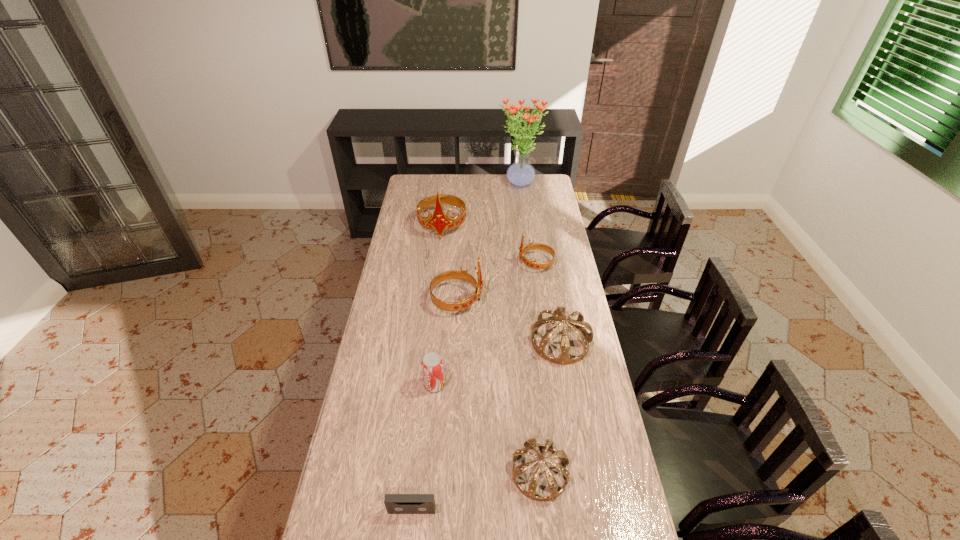
Where is `vacant region at the left edge of the desktop`? This screenshot has width=960, height=540. vacant region at the left edge of the desktop is located at coordinates (401, 216).

Identify the location of free region at the right edge of the desktop. (552, 206).

In the image, there is a desktop. Where is `vacant space at the far left corner`? This screenshot has height=540, width=960. vacant space at the far left corner is located at coordinates (415, 191).

This screenshot has height=540, width=960. I want to click on free space at the far right corner of the desktop, so click(544, 186).

Find the location of a particular element. free space between the red soda can and the rightmost red tiara is located at coordinates (485, 324).

Identify the location of free spot between the videotape and the fifth farthest object. (486, 426).

You are a GUI agent. You are given a task and a screenshot of the screen. Output one action in this format:
    pyautogui.click(x=<x>, y=<y>)
    Task: Click on the free space between the nearest object and the second nearest red tiara
    
    Given the screenshot: What is the action you would take?
    pyautogui.click(x=474, y=387)

You are a GUI agent. You are given a task and a screenshot of the screen. Output one action in this format:
    pyautogui.click(x=<x>, y=<y>)
    Task: Click on the free space between the biggest red tiara and the smallest red tiara
    This screenshot has width=960, height=540.
    Given the screenshot: What is the action you would take?
    pyautogui.click(x=489, y=245)

Locate an element on the screen. unoccupied area between the fourth nearest tiara and the flower arrangement is located at coordinates (528, 224).

Identify the location of free space between the tallest object and the nearer brown tiara. (530, 329).